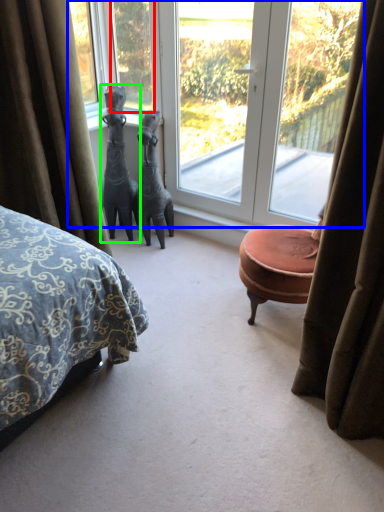
Question: Which object is positioned farthest from window (highlighted by a red box)? Select from window (highlighted by a blue box) and sculpture (highlighted by a green box).

Choices:
 (A) window
 (B) sculpture

Answer: (B)